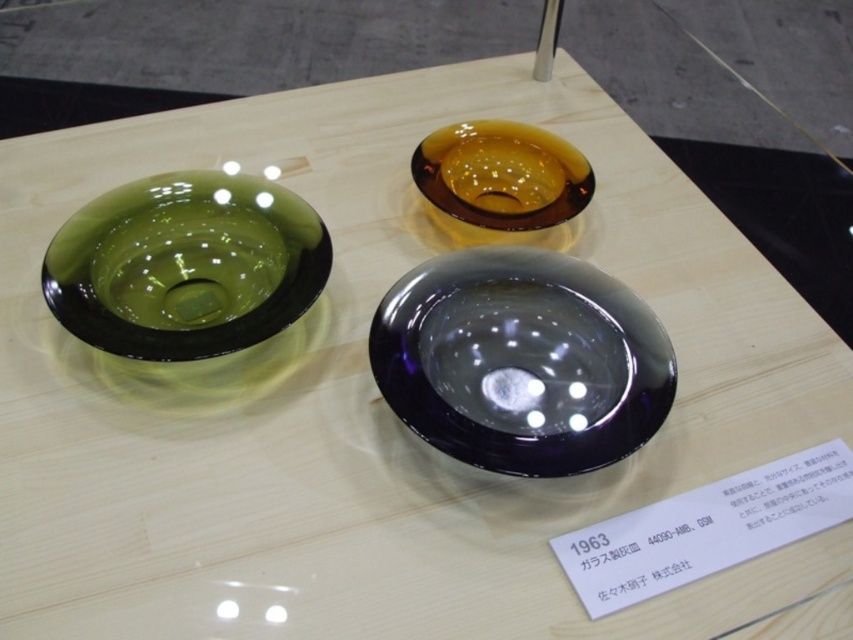
Between green glass bowl at left and amber glass bowl at upper center, which one has less height?

amber glass bowl at upper center is shorter.

Can you confirm if green glass bowl at left is bigger than amber glass bowl at upper center?

Yes, green glass bowl at left is bigger than amber glass bowl at upper center.

Is point (235, 253) less distant than point (515, 150)?

Yes.

Where is `green glass bowl at left`? This screenshot has width=853, height=640. green glass bowl at left is located at coordinates (184, 266).

This screenshot has height=640, width=853. Describe the element at coordinates (521, 358) in the screenshot. I see `amber glass bowl at center` at that location.

Does amber glass bowl at center appear under green glass bowl at left?

Yes, amber glass bowl at center is below green glass bowl at left.

In order to click on amber glass bowl at center in this screenshot , I will do `click(521, 358)`.

Is amber glass bowl at center smaller than amber glass bowl at upper center?

No.

Does amber glass bowl at center have a lesser width compared to amber glass bowl at upper center?

No, amber glass bowl at center is not thinner than amber glass bowl at upper center.

The image size is (853, 640). What are the coordinates of `amber glass bowl at center` in the screenshot? It's located at (521, 358).